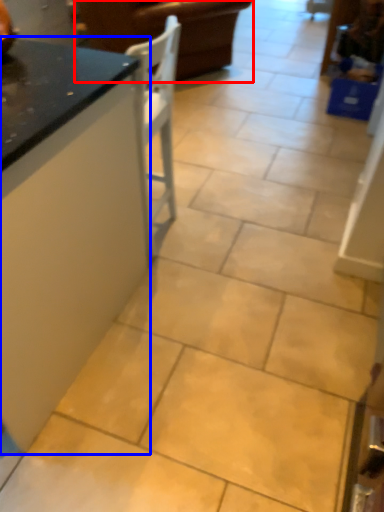
Question: Which point is further to the camera, furniture (highlighted by a red box) or countertop (highlighted by a blue box)?

Choices:
 (A) furniture
 (B) countertop

Answer: (A)